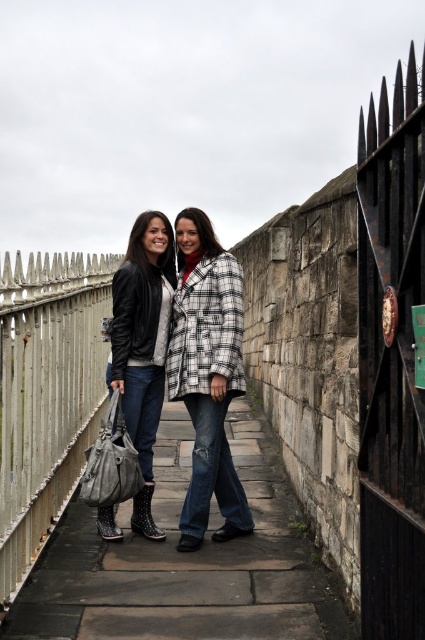
Can you confirm if leather boots at center is thinner than white checkered coat at center?

Incorrect, leather boots at center's width is not less than white checkered coat at center's.

Can you confirm if leather boots at center is positioned to the right of white checkered coat at center?

Yes, leather boots at center is to the right of white checkered coat at center.

Measure the distance between leather boots at center and camera.

They are 12.70 meters apart.

At what (x,y) coordinates should I click in order to perform the action: click on leather boots at center. Please return your answer as a coordinate pair (x, y). Looking at the image, I should click on (187, 561).

Between point (87, 353) and point (234, 305), which one is positioned behind?

The point (87, 353) is behind.

Describe the element at coordinates (45, 394) in the screenshot. I see `white painted metal fence at left` at that location.

At what (x,y) coordinates should I click in order to perform the action: click on white painted metal fence at left. Please return your answer as a coordinate pair (x, y). The width and height of the screenshot is (425, 640). Looking at the image, I should click on (45, 394).

In the scene shown: Is leather boots at center shorter than matte black leather jacket at center?

Correct, leather boots at center is not as tall as matte black leather jacket at center.

Does leather boots at center have a larger size compared to matte black leather jacket at center?

No, leather boots at center is not bigger than matte black leather jacket at center.

Which is in front, point (232, 412) or point (150, 232)?

Point (150, 232) is more forward.

Find the location of a particular element. The height and width of the screenshot is (640, 425). leather boots at center is located at coordinates (187, 561).